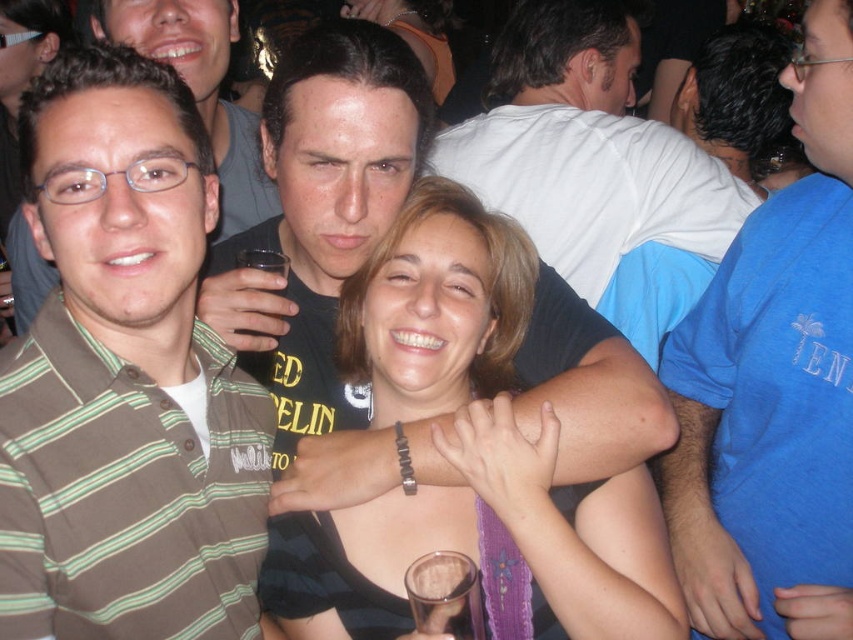
Question: Which point appears closest to the camera in this image?

Choices:
 (A) coord(595,109)
 (B) coord(827,570)
 (C) coord(306,141)
 (D) coord(13,376)

Answer: (D)

Question: Does smooth black tank top at center appear over white cotton shirt at upper center?

Choices:
 (A) yes
 (B) no

Answer: (B)

Question: Which point is farther from the camera taking this photo?

Choices:
 (A) (196, 65)
 (B) (666, 253)
 (C) (451, 512)
 (D) (225, 284)

Answer: (B)

Question: Is brown striped shirt at left closer to the viewer compared to black matte shirt at center?

Choices:
 (A) no
 (B) yes

Answer: (B)

Question: Considering the real-world distances, which object is farthest from the black matte shirt at center?

Choices:
 (A) brown striped shirt at left
 (B) matte brown shirt at left
 (C) blue cotton shirt at right

Answer: (B)

Question: Is blue cotton shirt at right thinner than matte brown shirt at left?

Choices:
 (A) yes
 (B) no

Answer: (A)